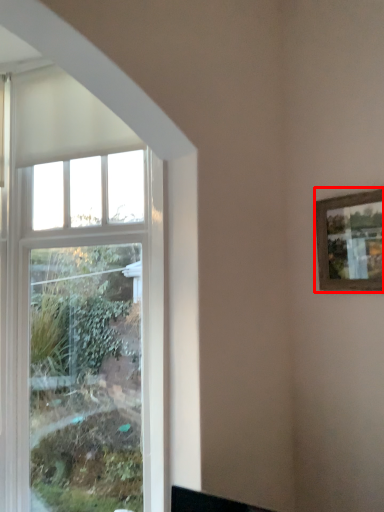
Question: From the image's perspective, what is the correct spatial relationship of picture frame (annotated by the red box) in relation to window?

Choices:
 (A) below
 (B) above

Answer: (B)